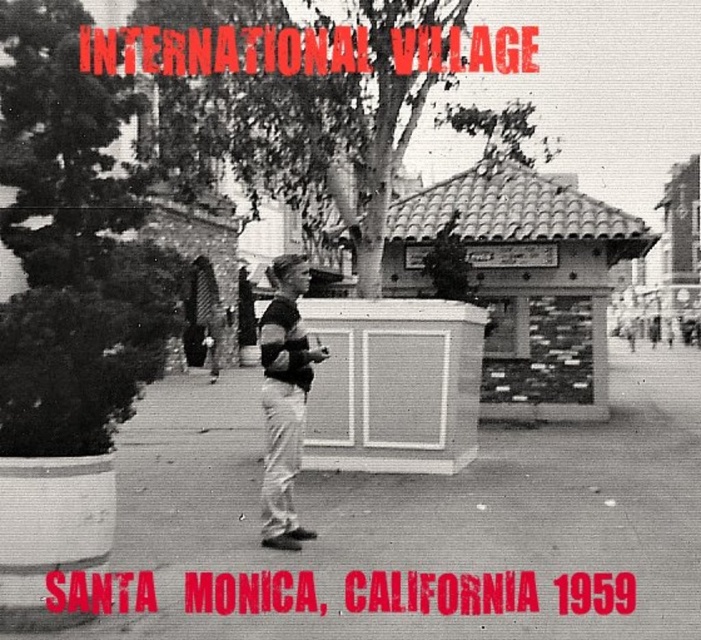
You are a photographer trying to capture the entire matte black shirt at center and the smooth concrete pavement at center in one frame. Given that the camera can only focus on objects within a 1.5 meter width, can both objects fit in the frame?

The smooth concrete pavement at center is wider than the matte black shirt at center. Since the camera can focus on objects within a 1.5 meter width, both objects can fit in the frame as long as their combined width does not exceed 1.5 meters. However, the exact fit depends on their individual widths and positioning.

Based on the scene described, can you determine which object, the smooth concrete pavement at center or the matte black shirt at center, is taller from the observer perspective?

The matte black shirt at center is taller than the smooth concrete pavement at center according to the description.

You are standing at the edge of the smooth concrete pavement at center and want to reach the matte black shirt at center. Given that the distance between them is 5.67 meters, how many steps would you need to take if each step covers approximately 0.75 meters?

To cover the 5.67 meters between the smooth concrete pavement at center and the matte black shirt at center, you would need approximately 7.56 steps. Since you can only take whole steps, you would need to take 8 steps to reach the matte black shirt at center.